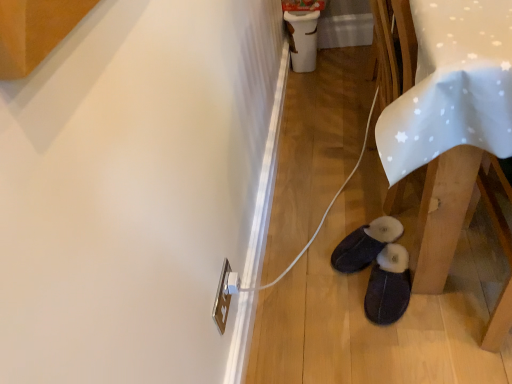
Question: From a real-world perspective, is dark suede slippers at lower center, which appears as the second footwear when viewed from the front, under dark gray suede slippers at lower center, the 1th footwear when ordered from front to back?

Choices:
 (A) no
 (B) yes

Answer: (B)

Question: Is dark gray suede slippers at lower center, arranged as the 2th footwear when viewed from the back, completely or partially inside dark suede slippers at lower center, which appears as the second footwear when viewed from the front?

Choices:
 (A) yes
 (B) no

Answer: (B)

Question: Does dark suede slippers at lower center, the 1th footwear from the back, come behind dark gray suede slippers at lower center, arranged as the 2th footwear when viewed from the back?

Choices:
 (A) yes
 (B) no

Answer: (A)

Question: Is dark suede slippers at lower center, the 1th footwear from the back, positioned beyond the bounds of dark gray suede slippers at lower center, the 1th footwear when ordered from front to back?

Choices:
 (A) no
 (B) yes

Answer: (B)

Question: Does dark suede slippers at lower center, the 1th footwear from the back, lie in front of dark gray suede slippers at lower center, arranged as the 2th footwear when viewed from the back?

Choices:
 (A) yes
 (B) no

Answer: (B)

Question: From a real-world perspective, relative to dark suede slippers at lower center, which appears as the second footwear when viewed from the front, is dark gray suede slippers at lower center, arranged as the 2th footwear when viewed from the back, vertically above or below?

Choices:
 (A) above
 (B) below

Answer: (A)

Question: In the image, is dark gray suede slippers at lower center, the 1th footwear when ordered from front to back, positioned in front of or behind dark suede slippers at lower center, which appears as the second footwear when viewed from the front?

Choices:
 (A) front
 (B) behind

Answer: (A)

Question: From the image's perspective, is dark gray suede slippers at lower center, arranged as the 2th footwear when viewed from the back, located above or below dark suede slippers at lower center, the 1th footwear from the back?

Choices:
 (A) above
 (B) below

Answer: (B)

Question: Choose the correct answer: Is dark gray suede slippers at lower center, arranged as the 2th footwear when viewed from the back, inside dark suede slippers at lower center, the 1th footwear from the back, or outside it?

Choices:
 (A) outside
 (B) inside

Answer: (A)

Question: From their relative heights in the image, would you say white fabric table at lower right is taller or shorter than dark suede slippers at lower center, which appears as the second footwear when viewed from the front?

Choices:
 (A) short
 (B) tall

Answer: (B)

Question: In the image, is white fabric table at lower right positioned in front of or behind dark suede slippers at lower center, the 1th footwear from the back?

Choices:
 (A) behind
 (B) front

Answer: (B)

Question: From a real-world perspective, is white fabric table at lower right positioned above or below dark suede slippers at lower center, the 1th footwear from the back?

Choices:
 (A) below
 (B) above

Answer: (B)

Question: Does point (432, 43) appear closer or farther from the camera than point (356, 251)?

Choices:
 (A) closer
 (B) farther

Answer: (A)

Question: From the image's perspective, is dark suede slippers at lower center, the 1th footwear from the back, located above or below white fabric table at lower right?

Choices:
 (A) below
 (B) above

Answer: (A)

Question: Is point (333, 266) positioned closer to the camera than point (453, 94)?

Choices:
 (A) closer
 (B) farther

Answer: (B)